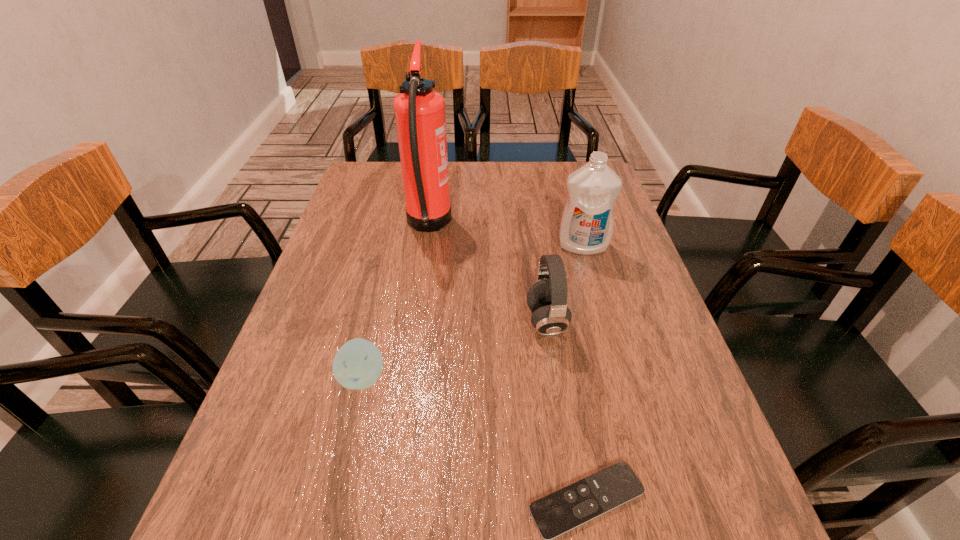
Find the location of a particular element. The image size is (960, 540). vacant space located on the ear cups of the headset is located at coordinates 425,322.

Where is `vacant space located 0.130m on the back of the fourth farthest object`? The image size is (960, 540). vacant space located 0.130m on the back of the fourth farthest object is located at coordinates (378, 314).

Identify the location of object that is at the left edge. Image resolution: width=960 pixels, height=540 pixels. 358,364.

Identify the location of object that is at the right edge. This screenshot has height=540, width=960. (586, 226).

Where is `vacant region at the far edge of the desktop`? vacant region at the far edge of the desktop is located at coordinates (516, 186).

I want to click on free space at the left edge, so click(x=283, y=357).

At what (x,y) coordinates should I click in order to perform the action: click on blank space at the right edge of the desktop. Please return your answer as a coordinate pair (x, y). Looking at the image, I should click on (611, 303).

Image resolution: width=960 pixels, height=540 pixels. In order to click on free space at the far left corner of the desktop in this screenshot , I will do `click(353, 181)`.

I want to click on vacant area that lies between the fire extinguisher and the detergent, so click(505, 236).

Locate an element on the screen. This screenshot has height=540, width=960. empty space between the tallest object and the fourth shortest object is located at coordinates (505, 236).